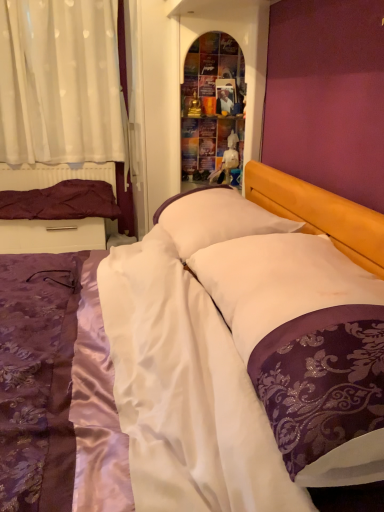
Question: Is white satin pillow at center, the 1th pillow in the right-to-left sequence, aimed at multicolored glass shelf at center?

Choices:
 (A) no
 (B) yes

Answer: (A)

Question: Does white satin pillow at center, the 1th pillow in the right-to-left sequence, appear on the right side of multicolored glass shelf at center?

Choices:
 (A) no
 (B) yes

Answer: (B)

Question: Is white satin pillow at center, the 1th pillow in the right-to-left sequence, turned away from multicolored glass shelf at center?

Choices:
 (A) yes
 (B) no

Answer: (B)

Question: Is white satin pillow at center, which is the 3th pillow in back-to-front order, outside multicolored glass shelf at center?

Choices:
 (A) yes
 (B) no

Answer: (A)

Question: Does white satin pillow at center, the 1th pillow in the right-to-left sequence, have a greater width compared to multicolored glass shelf at center?

Choices:
 (A) yes
 (B) no

Answer: (A)

Question: Considering the positions of white soft pillow at center, acting as the 2th pillow starting from the front, and purple satin bed at center in the image, is white soft pillow at center, acting as the 2th pillow starting from the front, taller or shorter than purple satin bed at center?

Choices:
 (A) tall
 (B) short

Answer: (B)

Question: Is white soft pillow at center, arranged as the 2th pillow when viewed from the right, in front of or behind purple satin bed at center in the image?

Choices:
 (A) behind
 (B) front

Answer: (A)

Question: From a real-world perspective, is white soft pillow at center, which appears as the second pillow when viewed from the back, above or below purple satin bed at center?

Choices:
 (A) below
 (B) above

Answer: (B)

Question: From the image's perspective, is white soft pillow at center, which appears as the second pillow when viewed from the back, positioned above or below purple satin bed at center?

Choices:
 (A) above
 (B) below

Answer: (A)

Question: From a real-world perspective, is white soft pillow at center, which appears as the second pillow when viewed from the back, positioned above or below white sheer curtain at upper left?

Choices:
 (A) above
 (B) below

Answer: (B)

Question: Would you say white soft pillow at center, positioned as the second pillow in left-to-right order, is inside or outside white sheer curtain at upper left?

Choices:
 (A) inside
 (B) outside

Answer: (B)

Question: Is white soft pillow at center, acting as the 2th pillow starting from the front, taller or shorter than white sheer curtain at upper left?

Choices:
 (A) tall
 (B) short

Answer: (B)

Question: Would you say white soft pillow at center, positioned as the second pillow in left-to-right order, is to the left or to the right of white sheer curtain at upper left in the picture?

Choices:
 (A) right
 (B) left

Answer: (A)

Question: From their relative heights in the image, would you say white sheer curtain at upper left is taller or shorter than purple satin pillow at left, which is counted as the 3th pillow, starting from the front?

Choices:
 (A) short
 (B) tall

Answer: (B)

Question: Considering the positions of white sheer curtain at upper left and purple satin pillow at left, which is the 1th pillow in left-to-right order, in the image, is white sheer curtain at upper left bigger or smaller than purple satin pillow at left, which is the 1th pillow in left-to-right order,?

Choices:
 (A) small
 (B) big

Answer: (B)